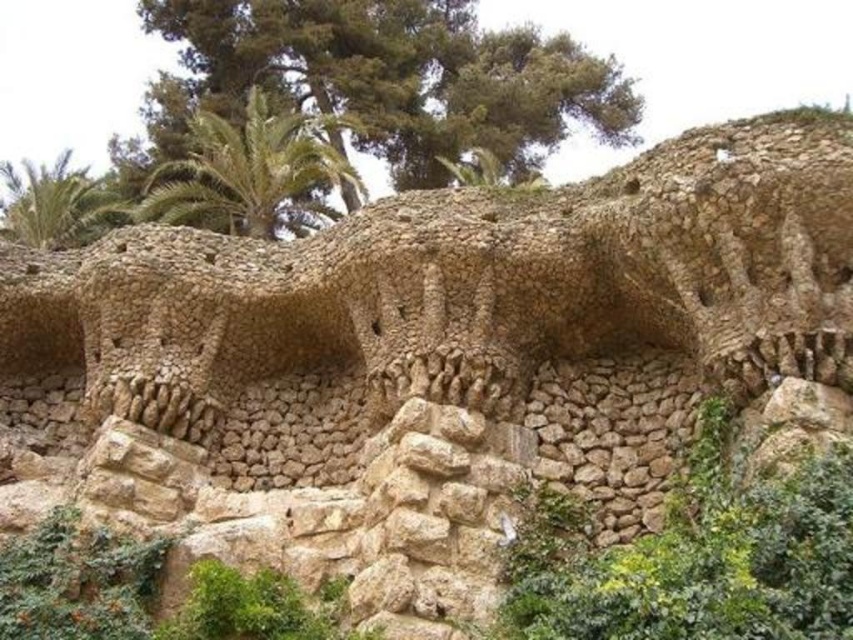
Does green leafy tree at upper center appear on the right side of green mossy rock at center?

No, green leafy tree at upper center is not to the right of green mossy rock at center.

Find the location of a particular element. The width and height of the screenshot is (853, 640). green leafy tree at upper center is located at coordinates (383, 80).

Can you confirm if green leafy palm tree at upper center is taller than green leafy palm tree at upper left?

No.

Who is lower down, green leafy palm tree at upper center or green leafy palm tree at upper left?

Positioned lower is green leafy palm tree at upper center.

Which is in front, point (241, 234) or point (83, 236)?

Point (241, 234) is more forward.

Locate an element on the screen. green leafy palm tree at upper center is located at coordinates (252, 173).

Can you confirm if green leafy shrub at lower left is positioned below green leafy palm tree at upper center?

Yes, green leafy shrub at lower left is below green leafy palm tree at upper center.

Identify the location of green leafy shrub at lower left. Image resolution: width=853 pixels, height=640 pixels. (144, 592).